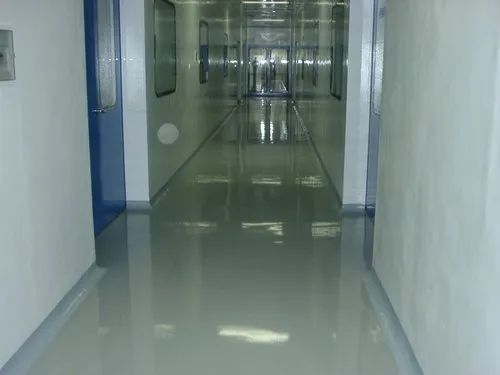
The width and height of the screenshot is (500, 375). I want to click on shiny floor, so click(232, 250).